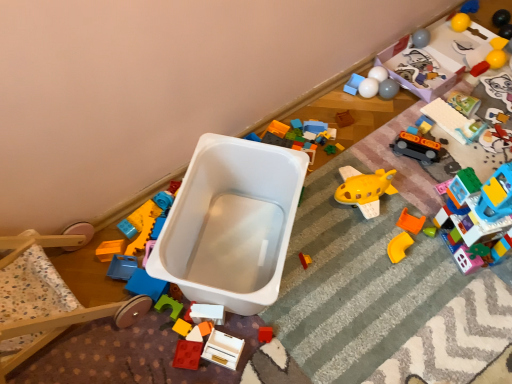
Identify the location of vacant area located to the right-hand side of orange matte plastic corner piece at lower right, the ninth toy positioned from the right. The height and width of the screenshot is (384, 512). (450, 263).